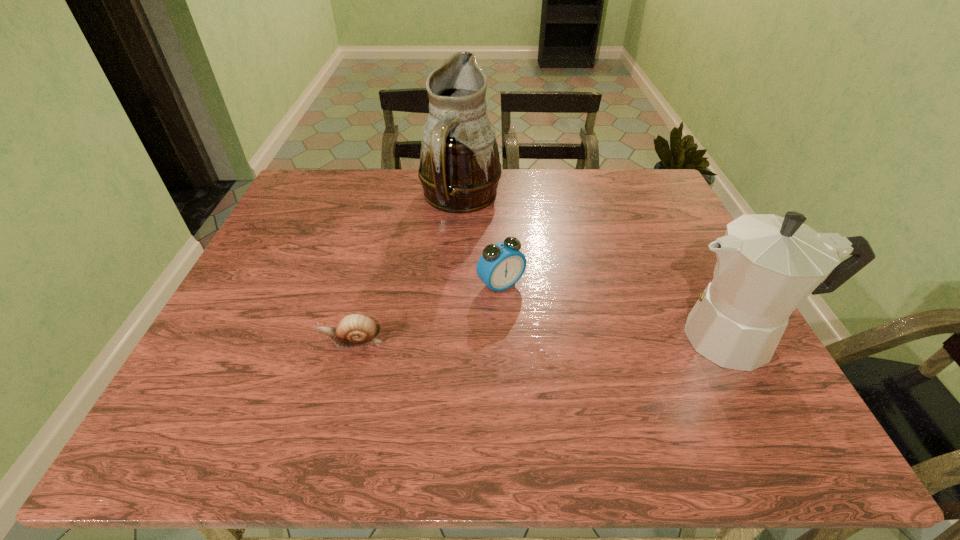
This screenshot has width=960, height=540. What are the coordinates of `vacant area between the second farthest object and the shortest object` in the screenshot? It's located at (426, 313).

This screenshot has height=540, width=960. What are the coordinates of `vacant region between the shortest object and the rightmost object` in the screenshot? It's located at (545, 340).

Identify the location of empty space that is in between the alarm clock and the tallest object. The height and width of the screenshot is (540, 960). coord(481,242).

This screenshot has width=960, height=540. What are the coordinates of `free spot between the alarm clock and the rightmost object` in the screenshot? It's located at (620, 311).

In order to click on empty location between the second farthest object and the farthest object in this screenshot , I will do click(481, 242).

This screenshot has height=540, width=960. Identify the location of free space between the shortest object and the second shortest object. (426, 313).

The image size is (960, 540). I want to click on blank region between the escargot and the farthest object, so click(x=406, y=271).

The width and height of the screenshot is (960, 540). I want to click on empty space that is in between the escargot and the tallest object, so click(406, 271).

This screenshot has height=540, width=960. Find the location of `vacant area that lies between the farthest object and the alarm clock`. vacant area that lies between the farthest object and the alarm clock is located at coordinates (481, 242).

Find the location of a particular element. This screenshot has width=960, height=540. vacant area that lies between the rightmost object and the shortest object is located at coordinates (545, 340).